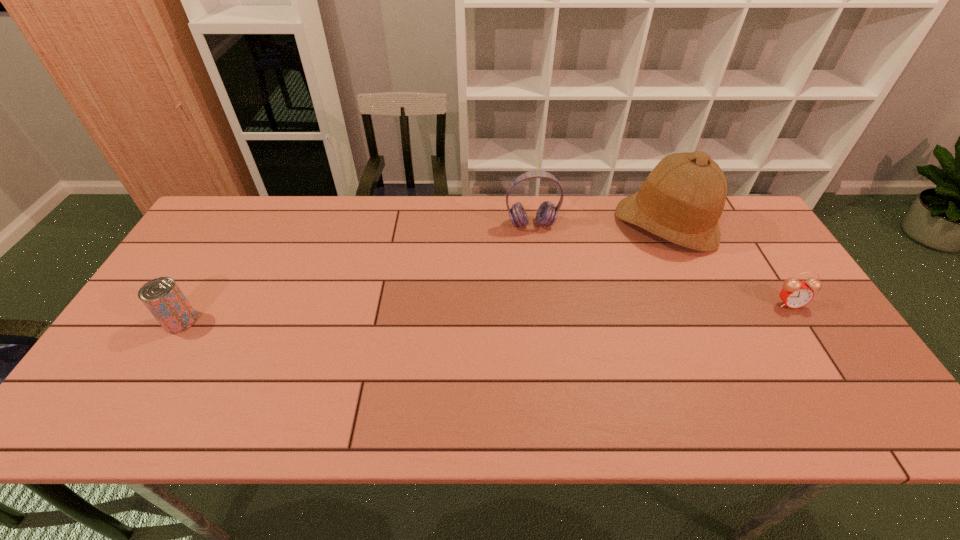
Identify the location of free point at the far edge. (532, 222).

Locate an element on the screen. vacant space at the near edge of the desktop is located at coordinates (554, 375).

The image size is (960, 540). I want to click on blank area at the left edge, so click(x=202, y=303).

Identify the location of free space at the right edge of the desktop. pos(774,340).

Find the location of a particular element. The width and height of the screenshot is (960, 540). vacant space at the far left corner is located at coordinates (267, 197).

I want to click on free space at the far right corner of the desktop, so click(x=727, y=225).

Where is `free space that is in between the hat and the beer can`? The height and width of the screenshot is (540, 960). free space that is in between the hat and the beer can is located at coordinates [x=422, y=273].

Find the location of a particular element. The height and width of the screenshot is (540, 960). free space that is in between the beer can and the third shortest object is located at coordinates (356, 273).

Find the location of a particular element. The image size is (960, 540). blank region between the rightmost object and the leftmost object is located at coordinates (485, 312).

This screenshot has height=540, width=960. I want to click on empty space between the second object from right to left and the leftmost object, so click(x=422, y=273).